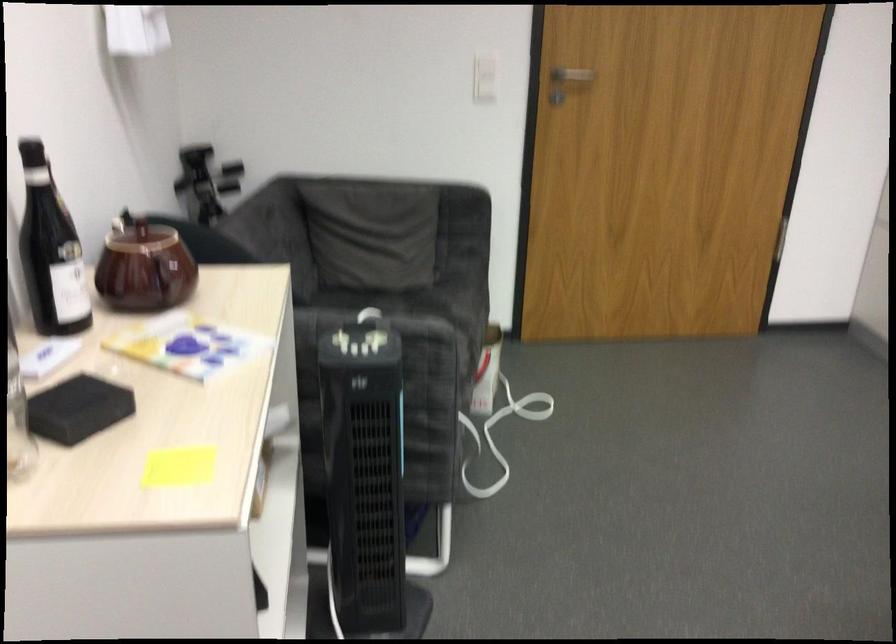
Where would you lift the pot lid handle? Please return your answer as a coordinate pair (x, y).

(168, 277)